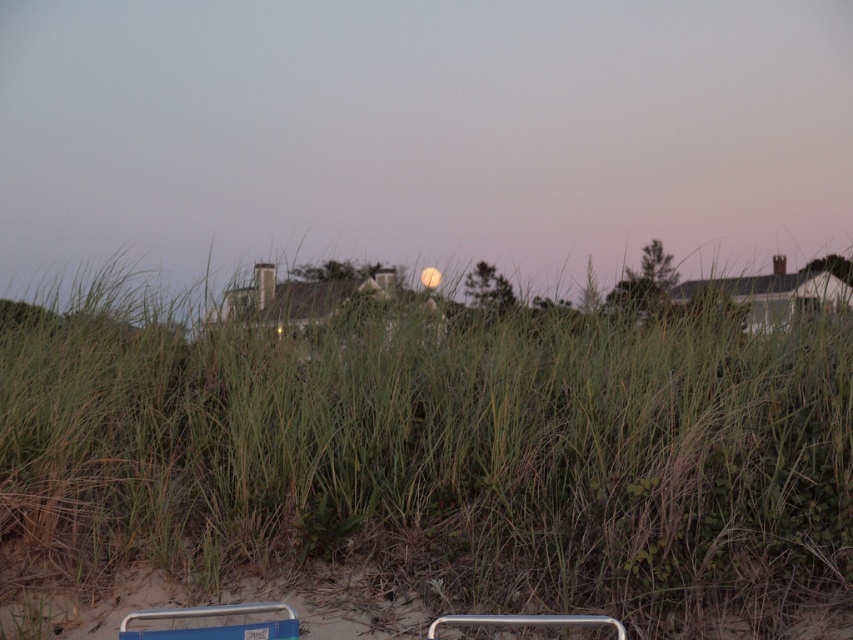
Is green grass at center smaller than metallic silver rail at lower center?

No.

Is green grass at center to the left of metallic silver rail at lower center from the viewer's perspective?

Indeed, green grass at center is positioned on the left side of metallic silver rail at lower center.

Find the location of a particular element. The image size is (853, 640). green grass at center is located at coordinates (438, 456).